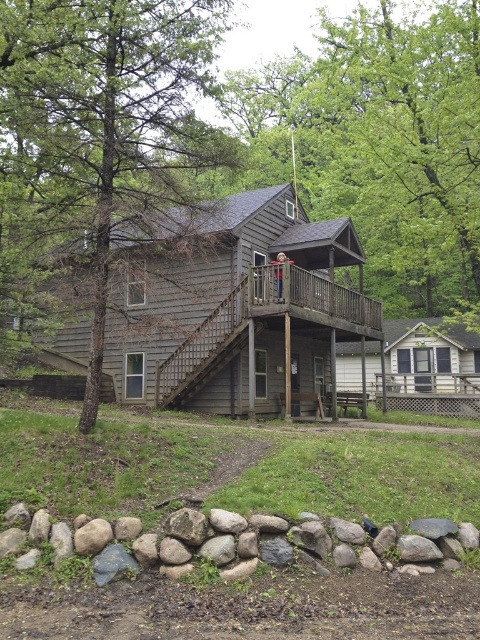
Based on the photo, you are standing at the base of the dirt path near the small stone retaining wall. You want to take a photo of the green leafy tree at upper center from the best angle. Which direction should you move relative to the retaining wall to position yourself optimally for the photo?

The green leafy tree at upper center is located at point coordinates, so you should move to the left side of the retaining wall to get the best angle for the photo.

Consider the image. You are standing at the base of the wooden staircase leading to the second floor porch of the two story house. You want to walk directly towards the point at coordinate (382, 141) which is on the green leafy tree at upper center. Will you have to walk through the wooden staircase to reach that point?

The point at coordinate (382, 141) is on the green leafy tree at upper center. Since the wooden staircase is part of the house structure leading to the second floor porch, and the tree is located in the upper center of the image, you would not need to walk through the staircase to reach the tree. Instead, you would need to navigate around the house or through the surrounding area to approach the tree.